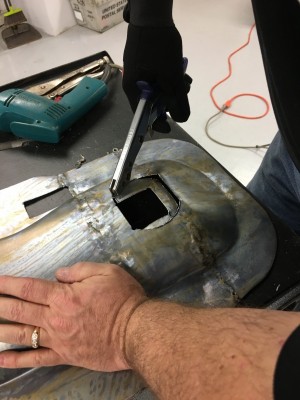
Where is `orange cord`? orange cord is located at coordinates (250, 117).